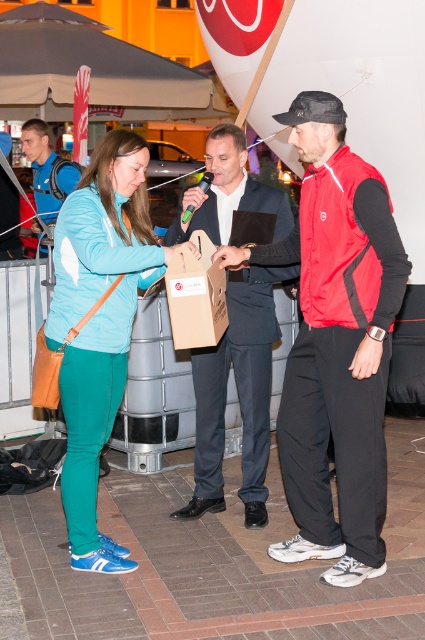
You are standing in the outdoor event scene and want to place a small decoration between the two points, point (110, 330) and point (44, 220). Which point should the decoration be closer to in order to appear closer to the front of the scene?

The decoration should be placed closer to point (110, 330) because it is closer to the viewer than point (44, 220).

What is the color of the jacket worn by the person at the coordinates point (99, 323)?

The teal fabric jacket at left is the color of the jacket worn by the person at the coordinates point (99, 323).

You are standing in the outdoor event scene and want to place a small decoration between the two points, point (306,337) and point (257,333). Which point should the decoration be closer to in order to appear closer to the viewer?

The decoration should be placed closer to point (306,337) because it is closer to the viewer than point (257,333).